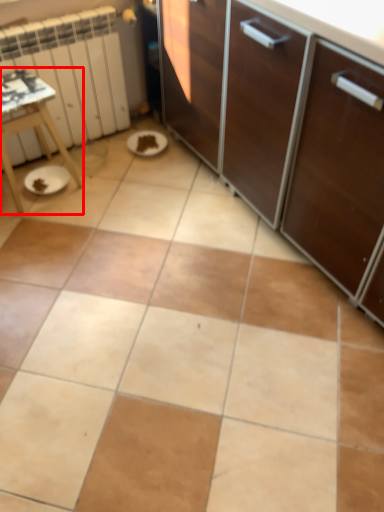
Question: From the image's perspective, where is table (annotated by the red box) located in relation to radiator in the image?

Choices:
 (A) above
 (B) below

Answer: (B)